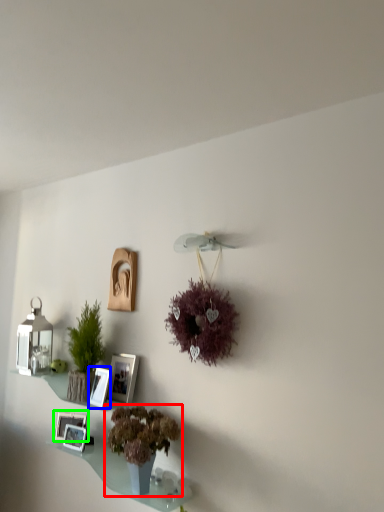
Question: Estimate the real-world distances between objects in this image. Which object is farther from houseplant (highlighted by a red box), picture frame (highlighted by a blue box) or picture frame (highlighted by a green box)?

Choices:
 (A) picture frame
 (B) picture frame

Answer: (B)